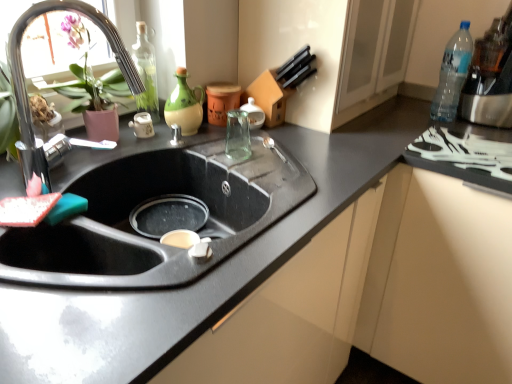
The image size is (512, 384). Describe the element at coordinates (463, 153) in the screenshot. I see `white plastic tray at right` at that location.

The image size is (512, 384). Describe the element at coordinates (25, 82) in the screenshot. I see `chrome metallic faucet at upper left` at that location.

Where is `chrome metallic faucet at upper left`? The image size is (512, 384). chrome metallic faucet at upper left is located at coordinates (25, 82).

What do you see at coordinates (146, 72) in the screenshot? I see `transparent glass bottle at upper left, placed as the third bottle when sorted from right to left` at bounding box center [146, 72].

In order to face green matte jug at upper center, placed as the 2th bottle when sorted from right to left, should I rotate leftwards or rightwards?

Rotate left and turn 8.598 degrees.

Where is `white plastic tray at right`? This screenshot has height=384, width=512. white plastic tray at right is located at coordinates (463, 153).

From the image's perspective, is white plastic tray at right on top of matte ceramic teapot at center?

No.

What's the angular difference between white plastic tray at right and matte ceramic teapot at center's facing directions?

There is a 88.5-degree angle between the facing directions of white plastic tray at right and matte ceramic teapot at center.

Is the position of white plastic tray at right more distant than that of matte ceramic teapot at center?

No, it is not.

Is white plastic tray at right far away from matte ceramic teapot at center?

No, there isn't a large distance between white plastic tray at right and matte ceramic teapot at center.

In the scene shown: Who is smaller, green matte jug at upper center, which is the second bottle in left-to-right order, or clear plastic bottle at upper right, which is the third bottle in left-to-right order?

green matte jug at upper center, which is the second bottle in left-to-right order, is smaller.

Which of these two, green matte jug at upper center, which is the second bottle in left-to-right order, or clear plastic bottle at upper right, which is the third bottle in left-to-right order, stands taller?

With more height is clear plastic bottle at upper right, which is the third bottle in left-to-right order.

From the image's perspective, starting from the clear plastic bottle at upper right, the first bottle viewed from the right, which bottle is the 2nd one below? Please provide its 2D coordinates.

[(184, 105)]

Is matte ceramic teapot at center aimed at clear plastic bottle at upper right, which is the third bottle in left-to-right order?

No, matte ceramic teapot at center is not facing towards clear plastic bottle at upper right, which is the third bottle in left-to-right order.

Considering the sizes of matte ceramic teapot at center and clear plastic bottle at upper right, the first bottle viewed from the right, in the image, is matte ceramic teapot at center wider or thinner than clear plastic bottle at upper right, the first bottle viewed from the right,?

Clearly, matte ceramic teapot at center has less width compared to clear plastic bottle at upper right, the first bottle viewed from the right.

How different are the orientations of chrome metallic faucet at upper left and matte ceramic teapot at center in degrees?

chrome metallic faucet at upper left and matte ceramic teapot at center are facing 45.9 degrees away from each other.

Is chrome metallic faucet at upper left situated inside matte ceramic teapot at center or outside?

chrome metallic faucet at upper left cannot be found inside matte ceramic teapot at center.

From the image's perspective, is chrome metallic faucet at upper left located above or below matte ceramic teapot at center?

Based on their image positions, chrome metallic faucet at upper left is located above matte ceramic teapot at center.

Looking at their sizes, would you say clear plastic bottle at upper right, which is the third bottle in left-to-right order, is wider or thinner than matte ceramic teapot at center?

Clearly, clear plastic bottle at upper right, which is the third bottle in left-to-right order, has more width compared to matte ceramic teapot at center.

How distant is clear plastic bottle at upper right, which is the third bottle in left-to-right order, from matte ceramic teapot at center?

clear plastic bottle at upper right, which is the third bottle in left-to-right order, and matte ceramic teapot at center are 1.11 meters apart.

Based on the photo, from the image's perspective, which one is positioned lower, clear plastic bottle at upper right, which is the third bottle in left-to-right order, or matte ceramic teapot at center?

matte ceramic teapot at center, from the image's perspective.

At what (x,y) coordinates should I click in order to perform the action: click on appliance that appears on the left of clear plastic bottle at upper right, the first bottle viewed from the right. Please return your answer as a coordinate pair (x, y). This screenshot has width=512, height=384. Looking at the image, I should click on (142, 125).

From a real-world perspective, which is physically below, chrome metallic faucet at upper left or white plastic tray at right?

white plastic tray at right, from a real-world perspective.

Is there a large distance between chrome metallic faucet at upper left and white plastic tray at right?

No, chrome metallic faucet at upper left is not far from white plastic tray at right.

Can you confirm if chrome metallic faucet at upper left is positioned to the right of white plastic tray at right?

No.

Is transparent glass bottle at upper left, which is the 1th bottle in left-to-right order, oriented away from clear plastic bottle at upper right, the first bottle viewed from the right?

No, transparent glass bottle at upper left, which is the 1th bottle in left-to-right order, is not facing away from clear plastic bottle at upper right, the first bottle viewed from the right.

Are transparent glass bottle at upper left, which is the 1th bottle in left-to-right order, and clear plastic bottle at upper right, the first bottle viewed from the right, beside each other?

No, transparent glass bottle at upper left, which is the 1th bottle in left-to-right order, is not next to clear plastic bottle at upper right, the first bottle viewed from the right.

From the image's perspective, relative to clear plastic bottle at upper right, which is the third bottle in left-to-right order, is transparent glass bottle at upper left, which is the 1th bottle in left-to-right order, above or below?

From the image's perspective, transparent glass bottle at upper left, which is the 1th bottle in left-to-right order, appears below clear plastic bottle at upper right, which is the third bottle in left-to-right order.

Locate an element on the screen. the 1st bottle below when counting from the clear plastic bottle at upper right, the first bottle viewed from the right (from the image's perspective) is located at coordinates (146, 72).

Identify the location of appliance on the left of white plastic tray at right. (142, 125).

You are a GUI agent. You are given a task and a screenshot of the screen. Output one action in this format:
    pyautogui.click(x=<x>, y=<y>)
    Task: Click on the 2nd bottle above the green matte jug at upper center, placed as the 2th bottle when sorted from right to left (from a real-world perspective)
    
    Given the screenshot: What is the action you would take?
    pyautogui.click(x=452, y=74)

When comparing their distances from white plastic tray at right, does matte ceramic teapot at center or chrome metallic faucet at upper left seem further?

chrome metallic faucet at upper left.

Which object lies nearer to the anchor point chrome metallic faucet at upper left, matte ceramic teapot at center or white plastic tray at right?

matte ceramic teapot at center is positioned closer to the anchor chrome metallic faucet at upper left.

Looking at the image, which one is located closer to matte ceramic teapot at center, green matte jug at upper center, which is the second bottle in left-to-right order, or transparent glass bottle at upper left, which is the 1th bottle in left-to-right order?

Among the two, transparent glass bottle at upper left, which is the 1th bottle in left-to-right order, is located nearer to matte ceramic teapot at center.

Based on the photo, considering their positions, is clear plastic bottle at upper right, which is the third bottle in left-to-right order, positioned closer to matte ceramic teapot at center than transparent glass bottle at upper left, which is the 1th bottle in left-to-right order?

transparent glass bottle at upper left, which is the 1th bottle in left-to-right order.

When comparing their distances from transparent glass bottle at upper left, placed as the third bottle when sorted from right to left, does clear plastic bottle at upper right, the first bottle viewed from the right, or green matte jug at upper center, placed as the 2th bottle when sorted from right to left, seem further?

The object further to transparent glass bottle at upper left, placed as the third bottle when sorted from right to left, is clear plastic bottle at upper right, the first bottle viewed from the right.

Based on the photo, considering their positions, is transparent glass bottle at upper left, which is the 1th bottle in left-to-right order, positioned further to clear plastic bottle at upper right, which is the third bottle in left-to-right order, than white plastic tray at right?

transparent glass bottle at upper left, which is the 1th bottle in left-to-right order, is positioned further to the anchor clear plastic bottle at upper right, which is the third bottle in left-to-right order.

Looking at the image, which one is located further to clear plastic bottle at upper right, which is the third bottle in left-to-right order, matte ceramic teapot at center or chrome metallic faucet at upper left?

chrome metallic faucet at upper left is further to clear plastic bottle at upper right, which is the third bottle in left-to-right order.

Based on their spatial positions, is transparent glass bottle at upper left, placed as the third bottle when sorted from right to left, or clear plastic bottle at upper right, which is the third bottle in left-to-right order, further from white plastic tray at right?

Based on the image, transparent glass bottle at upper left, placed as the third bottle when sorted from right to left, appears to be further to white plastic tray at right.

This screenshot has width=512, height=384. What are the coordinates of `stove between chrome metallic faucet at upper left and clear plastic bottle at upper right, which is the third bottle in left-to-right order, from left to right` in the screenshot? It's located at (463, 153).

You are a GUI agent. You are given a task and a screenshot of the screen. Output one action in this format:
    pyautogui.click(x=<x>, y=<y>)
    Task: Click on the appliance situated between chrome metallic faucet at upper left and white plastic tray at right from left to right
    This screenshot has height=384, width=512.
    Given the screenshot: What is the action you would take?
    pyautogui.click(x=142, y=125)

This screenshot has width=512, height=384. I want to click on stove between green matte jug at upper center, which is the second bottle in left-to-right order, and clear plastic bottle at upper right, which is the third bottle in left-to-right order, so click(x=463, y=153).

At what (x,y) coordinates should I click in order to perform the action: click on stove between matte ceramic teapot at center and clear plastic bottle at upper right, the first bottle viewed from the right, in the horizontal direction. Please return your answer as a coordinate pair (x, y). Looking at the image, I should click on (463, 153).